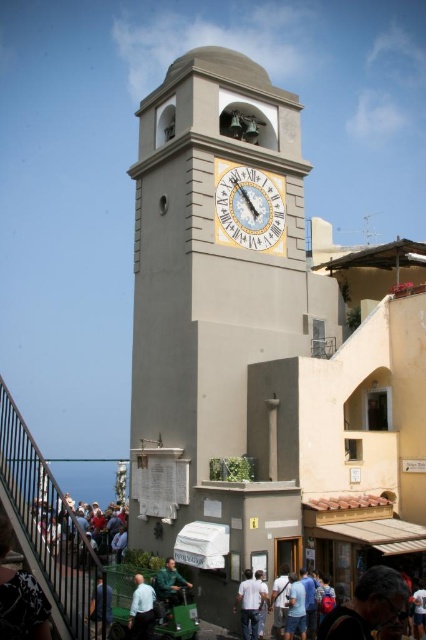
The width and height of the screenshot is (426, 640). What do you see at coordinates (249, 208) in the screenshot?
I see `wooden clock face at center` at bounding box center [249, 208].

At what (x,y) coordinates should I click in order to perform the action: click on wooden clock face at center. Please return your answer as a coordinate pair (x, y). The width and height of the screenshot is (426, 640). Looking at the image, I should click on (249, 208).

Which is in front, point (249, 184) or point (304, 596)?

Point (304, 596) is in front.

Find the location of a particular element. This screenshot has width=426, height=640. wooden clock face at center is located at coordinates (249, 208).

Can you confirm if smooth concrete clock tower at center is thinner than dark brown leather jacket at lower right?

No, smooth concrete clock tower at center is not thinner than dark brown leather jacket at lower right.

Between smooth concrete clock tower at center and dark brown leather jacket at lower right, which one is positioned higher?

smooth concrete clock tower at center is higher up.

Where is `smooth concrete clock tower at center`? smooth concrete clock tower at center is located at coordinates pos(218,314).

Measure the distance between point (x=241, y=612) and camera.

The distance of point (x=241, y=612) from camera is 113.68 feet.

Where is `white cotton shirt at center`? Image resolution: width=426 pixels, height=640 pixels. white cotton shirt at center is located at coordinates (250, 604).